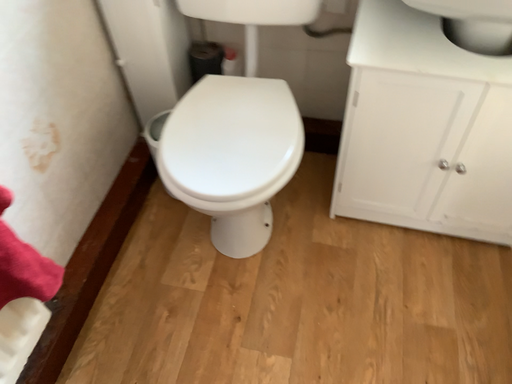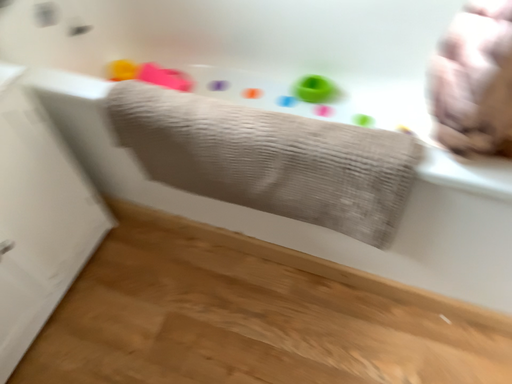
Question: How did the camera likely rotate when shooting the video?

Choices:
 (A) rotated left
 (B) rotated right

Answer: (B)